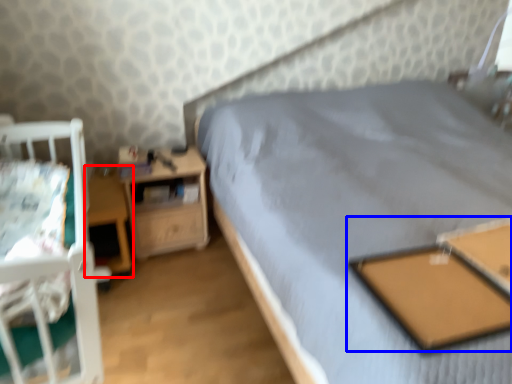
Question: Which object appears closest to the camera in this image, table (highlighted by a red box) or table (highlighted by a blue box)?

Choices:
 (A) table
 (B) table

Answer: (B)